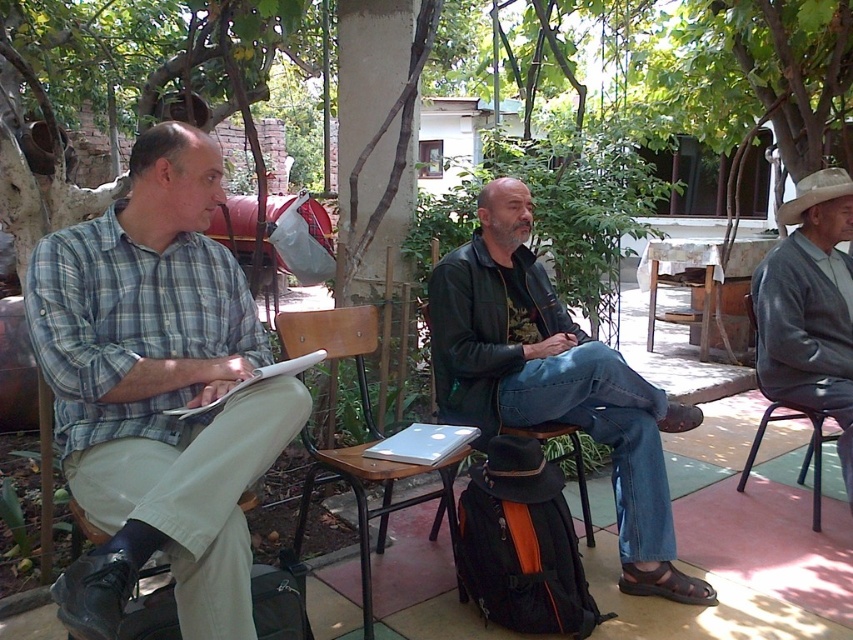
Is point (846, 288) positioned after point (689, 262)?

No, (846, 288) is in front of (689, 262).

Does gray woolen sweater at right have a larger size compared to white cloth-covered table at center?

No.

Is point (822, 348) positioned before point (758, 243)?

Yes, it is.

I want to click on gray woolen sweater at right, so click(x=809, y=307).

Which is below, leather jacket at center or brown wooden chair at center?

Positioned lower is brown wooden chair at center.

Who is taller, leather jacket at center or brown wooden chair at center?

leather jacket at center is taller.

Where is `leather jacket at center`? The width and height of the screenshot is (853, 640). leather jacket at center is located at coordinates (554, 381).

Describe the element at coordinates (554, 381) in the screenshot. I see `leather jacket at center` at that location.

Does leather jacket at center have a lesser width compared to gray woolen sweater at right?

No.

Is point (506, 362) in front of point (764, 320)?

Yes, point (506, 362) is closer to viewer.

The image size is (853, 640). In order to click on leather jacket at center in this screenshot , I will do `click(554, 381)`.